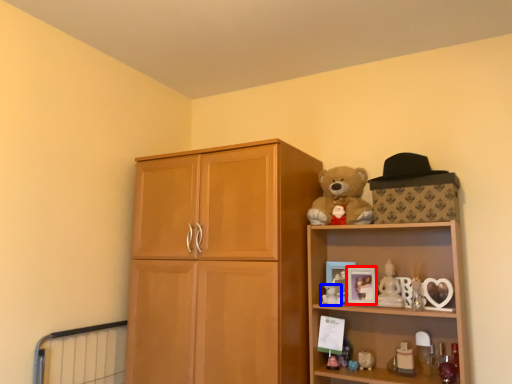
Question: Which point is closer to the camera, picture frame (highlighted by a red box) or toy (highlighted by a blue box)?

Choices:
 (A) picture frame
 (B) toy

Answer: (B)